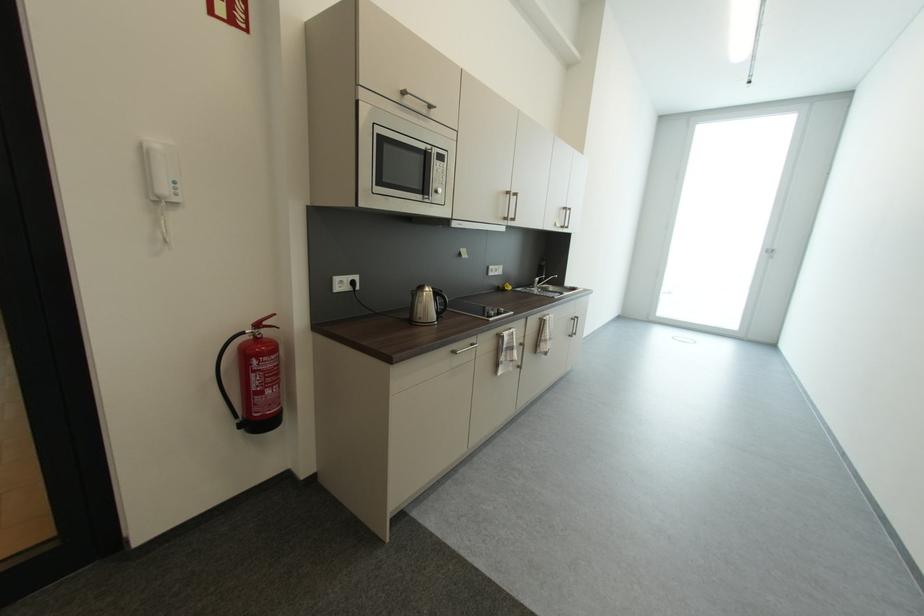
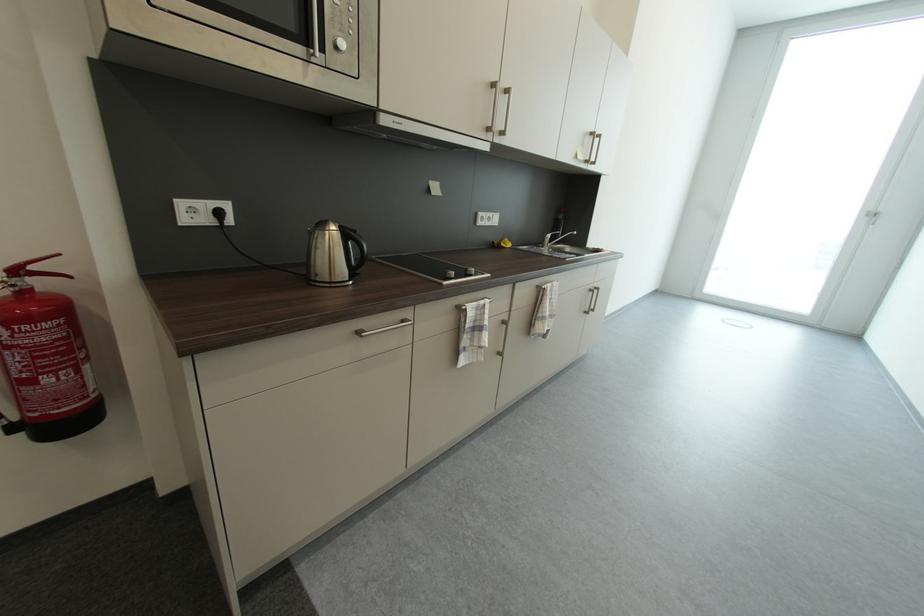
What movement of the cameraman would produce the second image?

The cameraman walked toward right, forward.